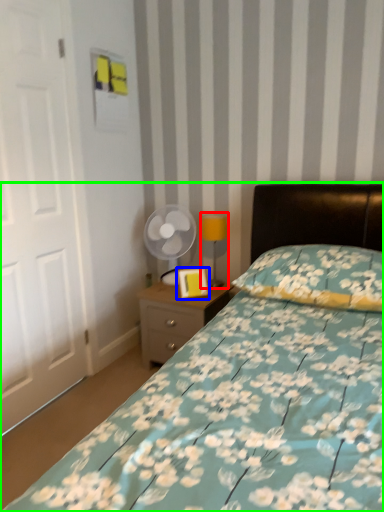
Question: Estimate the real-world distances between objects in this image. Which object is closer to table lamp (highlighted by a red box), picture frame (highlighted by a blue box) or bed (highlighted by a green box)?

Choices:
 (A) picture frame
 (B) bed

Answer: (A)